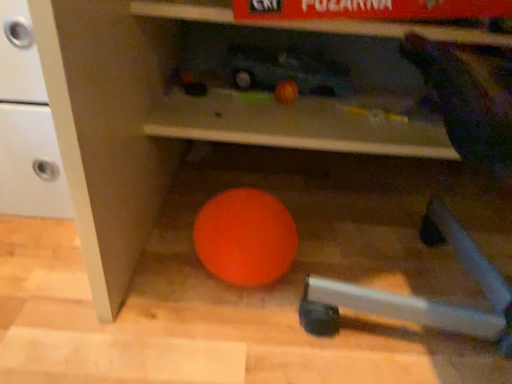
Question: Is orange matte bean bag chair at lower left completely or partially outside of orange rubber ball at center?

Choices:
 (A) yes
 (B) no

Answer: (A)

Question: Could you tell me if orange matte bean bag chair at lower left is facing orange rubber ball at center?

Choices:
 (A) yes
 (B) no

Answer: (B)

Question: From a real-world perspective, is orange matte bean bag chair at lower left positioned under orange rubber ball at center based on gravity?

Choices:
 (A) yes
 (B) no

Answer: (B)

Question: Does orange matte bean bag chair at lower left have a lesser width compared to orange rubber ball at center?

Choices:
 (A) yes
 (B) no

Answer: (B)

Question: Considering the relative sizes of orange matte bean bag chair at lower left and orange rubber ball at center in the image provided, is orange matte bean bag chair at lower left taller than orange rubber ball at center?

Choices:
 (A) no
 (B) yes

Answer: (B)

Question: Can you confirm if orange matte bean bag chair at lower left is smaller than orange rubber ball at center?

Choices:
 (A) yes
 (B) no

Answer: (B)

Question: Is orange rubber ball at center surrounding orange matte bean bag chair at lower left?

Choices:
 (A) no
 (B) yes

Answer: (A)

Question: From the image's perspective, is orange rubber ball at center on orange matte bean bag chair at lower left?

Choices:
 (A) no
 (B) yes

Answer: (A)

Question: From a real-world perspective, is orange rubber ball at center physically below orange matte bean bag chair at lower left?

Choices:
 (A) no
 (B) yes

Answer: (B)

Question: Can you confirm if orange rubber ball at center is shorter than orange matte bean bag chair at lower left?

Choices:
 (A) no
 (B) yes

Answer: (B)

Question: Is orange rubber ball at center in front of orange matte bean bag chair at lower left?

Choices:
 (A) yes
 (B) no

Answer: (B)

Question: Does orange rubber ball at center have a lesser width compared to orange matte bean bag chair at lower left?

Choices:
 (A) yes
 (B) no

Answer: (A)

Question: Is orange rubber ball at center inside the boundaries of orange matte bean bag chair at lower left, or outside?

Choices:
 (A) outside
 (B) inside

Answer: (A)